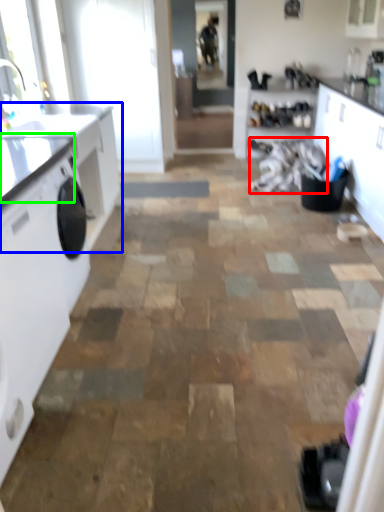
Question: Which object is the closest to the laundry (highlighted by a red box)? Choose among these: countertop (highlighted by a blue box) or counter top (highlighted by a green box).

Choices:
 (A) countertop
 (B) counter top

Answer: (A)